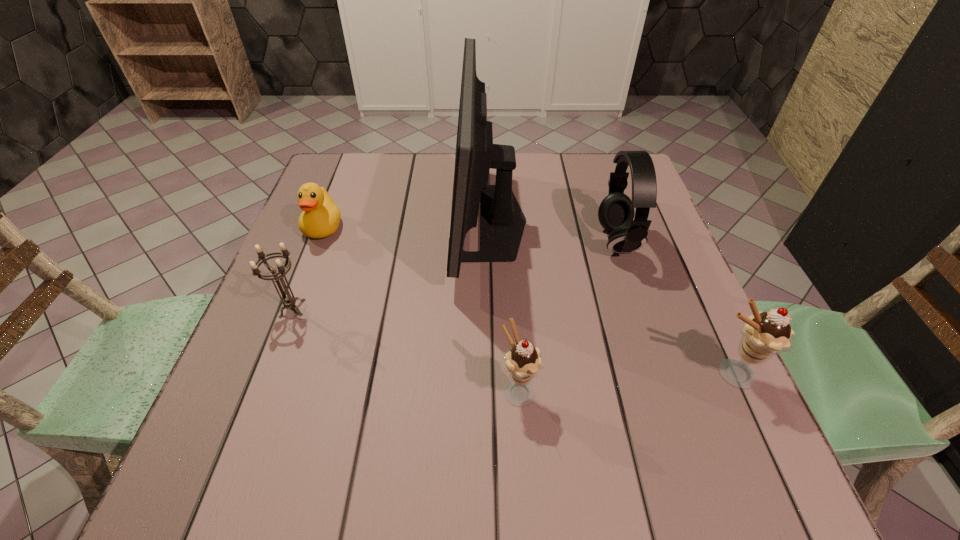
Where is `the left icecream`? The image size is (960, 540). the left icecream is located at coordinates (523, 361).

At what (x,y) coordinates should I click in order to perform the action: click on the right icecream. Please return your answer as a coordinate pair (x, y). The image size is (960, 540). Looking at the image, I should click on (764, 334).

This screenshot has height=540, width=960. What are the coordinates of `the rightmost object` in the screenshot? It's located at (764, 334).

Locate an element on the screen. This screenshot has width=960, height=540. computer monitor is located at coordinates (502, 220).

The height and width of the screenshot is (540, 960). Identify the location of the shortest object. (320, 218).

The width and height of the screenshot is (960, 540). Find the location of `candle holder`. candle holder is located at coordinates (289, 301).

Where is `earphone`? The width and height of the screenshot is (960, 540). earphone is located at coordinates click(x=616, y=212).

The width and height of the screenshot is (960, 540). I want to click on free point located on the back of the left icecream, so [516, 340].

At what (x,y) coordinates should I click in order to perform the action: click on vacant region located 0.200m on the left of the rightmost object. Please return your answer as a coordinate pair (x, y). Image resolution: width=960 pixels, height=540 pixels. Looking at the image, I should click on (592, 374).

I want to click on vacant space located on the screen side of the computer monitor, so click(418, 221).